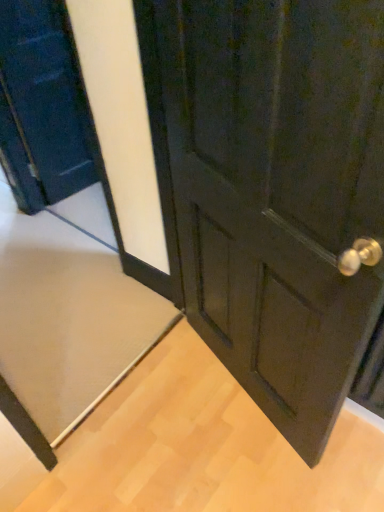
The height and width of the screenshot is (512, 384). Find the location of `beige carpet at lower left`. beige carpet at lower left is located at coordinates click(x=68, y=317).

Which of these two, matte black door at left, placed as the first door when sorted from left to right, or beige carpet at lower left, stands taller?

matte black door at left, placed as the first door when sorted from left to right, is taller.

In the scene shown: Is matte black door at left, which appears as the 2th door when viewed from the right, oriented towards beige carpet at lower left?

Yes, matte black door at left, which appears as the 2th door when viewed from the right, faces towards beige carpet at lower left.

In the scene shown: Is the surface of matte black door at left, which appears as the 2th door when viewed from the right, in direct contact with beige carpet at lower left?

No, matte black door at left, which appears as the 2th door when viewed from the right, is not making contact with beige carpet at lower left.

Considering the relative sizes of matte black door at left, placed as the first door when sorted from left to right, and beige carpet at lower left in the image provided, is matte black door at left, placed as the first door when sorted from left to right, bigger than beige carpet at lower left?

Yes, matte black door at left, placed as the first door when sorted from left to right, is bigger than beige carpet at lower left.

Which is more to the right, matte black door at left, placed as the first door when sorted from left to right, or matte black door at center, the 2th door viewed from the left?

Positioned to the right is matte black door at center, the 2th door viewed from the left.

Where is `door below the matte black door at left, placed as the first door when sorted from left to right (from the image's perspective)`? The width and height of the screenshot is (384, 512). door below the matte black door at left, placed as the first door when sorted from left to right (from the image's perspective) is located at coordinates (275, 193).

Is matte black door at left, which appears as the 2th door when viewed from the right, aimed at matte black door at center, positioned as the 1th door in right-to-left order?

No.

Is matte black door at left, placed as the first door when sorted from left to right, taller than matte black door at center, positioned as the 1th door in right-to-left order?

In fact, matte black door at left, placed as the first door when sorted from left to right, may be shorter than matte black door at center, positioned as the 1th door in right-to-left order.

Would you say beige carpet at lower left is to the left or to the right of matte black door at left, which appears as the 2th door when viewed from the right, in the picture?

Based on their positions, beige carpet at lower left is located to the left of matte black door at left, which appears as the 2th door when viewed from the right.

Is matte black door at left, which appears as the 2th door when viewed from the right, surrounded by beige carpet at lower left?

That's incorrect, matte black door at left, which appears as the 2th door when viewed from the right, is not inside beige carpet at lower left.

From a real-world perspective, starting from the beige carpet at lower left, which door is the 1st one vertically above it? Please provide its 2D coordinates.

[(42, 106)]

Does beige carpet at lower left have a greater width compared to matte black door at left, which appears as the 2th door when viewed from the right?

Indeed, beige carpet at lower left has a greater width compared to matte black door at left, which appears as the 2th door when viewed from the right.

Could you tell me if matte black door at center, the 2th door viewed from the left, is facing matte black door at left, placed as the first door when sorted from left to right?

No.

From a real-world perspective, between matte black door at center, positioned as the 1th door in right-to-left order, and matte black door at left, placed as the first door when sorted from left to right, who is vertically higher?

matte black door at center, positioned as the 1th door in right-to-left order, from a real-world perspective.

Can you confirm if matte black door at center, the 2th door viewed from the left, is wider than matte black door at left, placed as the first door when sorted from left to right?

Yes, matte black door at center, the 2th door viewed from the left, is wider than matte black door at left, placed as the first door when sorted from left to right.

Which of these two, matte black door at center, positioned as the 1th door in right-to-left order, or matte black door at left, which appears as the 2th door when viewed from the right, stands taller?

matte black door at center, positioned as the 1th door in right-to-left order.

Does point (213, 259) come in front of point (78, 298)?

Yes, point (213, 259) is in front of point (78, 298).

From a real-world perspective, does matte black door at center, the 2th door viewed from the left, sit lower than beige carpet at lower left?

No, from a real-world perspective, matte black door at center, the 2th door viewed from the left, is not beneath beige carpet at lower left.

Based on their positions, is matte black door at center, the 2th door viewed from the left, located to the left or right of beige carpet at lower left?

matte black door at center, the 2th door viewed from the left, is positioned on beige carpet at lower left's right side.

Locate an element on the screen. This screenshot has width=384, height=512. doormat on the left of the matte black door at center, positioned as the 1th door in right-to-left order is located at coordinates (68, 317).

Is beige carpet at lower left oriented towards matte black door at center, positioned as the 1th door in right-to-left order?

No, beige carpet at lower left is not turned towards matte black door at center, positioned as the 1th door in right-to-left order.

Is beige carpet at lower left far from matte black door at center, the 2th door viewed from the left?

Actually, beige carpet at lower left and matte black door at center, the 2th door viewed from the left, are a little close together.

Is beige carpet at lower left shorter than matte black door at center, the 2th door viewed from the left?

Yes, beige carpet at lower left is shorter than matte black door at center, the 2th door viewed from the left.

In the image, is beige carpet at lower left positioned in front of or behind matte black door at center, positioned as the 1th door in right-to-left order?

beige carpet at lower left is positioned farther from the viewer than matte black door at center, positioned as the 1th door in right-to-left order.

The height and width of the screenshot is (512, 384). I want to click on doormat on the left of matte black door at left, placed as the first door when sorted from left to right, so click(x=68, y=317).

At what (x,y) coordinates should I click in order to perform the action: click on door that is in front of the matte black door at left, which appears as the 2th door when viewed from the right. Please return your answer as a coordinate pair (x, y). This screenshot has height=512, width=384. Looking at the image, I should click on (275, 193).

Based on their spatial positions, is matte black door at center, the 2th door viewed from the left, or beige carpet at lower left closer to matte black door at left, which appears as the 2th door when viewed from the right?

beige carpet at lower left is positioned closer to the anchor matte black door at left, which appears as the 2th door when viewed from the right.

When comparing their distances from beige carpet at lower left, does matte black door at left, placed as the first door when sorted from left to right, or matte black door at center, the 2th door viewed from the left, seem further?

matte black door at center, the 2th door viewed from the left, is positioned further to the anchor beige carpet at lower left.

Considering their positions, is beige carpet at lower left positioned closer to matte black door at center, the 2th door viewed from the left, than matte black door at left, placed as the first door when sorted from left to right?

Based on the image, beige carpet at lower left appears to be nearer to matte black door at center, the 2th door viewed from the left.

Estimate the real-world distances between objects in this image. Which object is closer to beige carpet at lower left, matte black door at center, positioned as the 1th door in right-to-left order, or matte black door at left, which appears as the 2th door when viewed from the right?

matte black door at left, which appears as the 2th door when viewed from the right, lies closer to beige carpet at lower left than the other object.

Based on their spatial positions, is matte black door at left, which appears as the 2th door when viewed from the right, or beige carpet at lower left closer to matte black door at center, the 2th door viewed from the left?

beige carpet at lower left is closer to matte black door at center, the 2th door viewed from the left.

Estimate the real-world distances between objects in this image. Which object is further from matte black door at left, which appears as the 2th door when viewed from the right, beige carpet at lower left or matte black door at center, the 2th door viewed from the left?

Among the two, matte black door at center, the 2th door viewed from the left, is located further to matte black door at left, which appears as the 2th door when viewed from the right.

Identify the location of door located between matte black door at center, positioned as the 1th door in right-to-left order, and beige carpet at lower left in the depth direction. (42, 106).